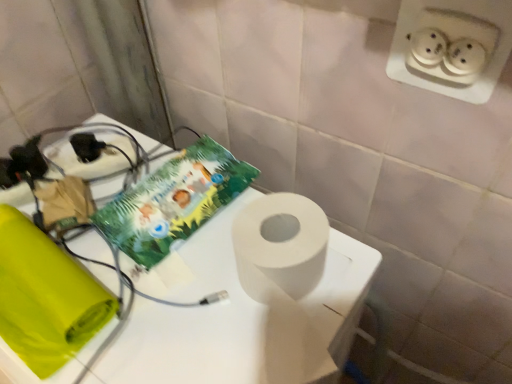
Question: Considering the relative positions of white matte table at center and green paper comic book at upper center in the image provided, is white matte table at center to the left of green paper comic book at upper center from the viewer's perspective?

Choices:
 (A) no
 (B) yes

Answer: (B)

Question: Can you confirm if white matte table at center is wider than green paper comic book at upper center?

Choices:
 (A) yes
 (B) no

Answer: (A)

Question: Is white matte table at center far away from green paper comic book at upper center?

Choices:
 (A) no
 (B) yes

Answer: (A)

Question: From a real-world perspective, does white matte table at center stand above green paper comic book at upper center?

Choices:
 (A) no
 (B) yes

Answer: (A)

Question: Is white matte table at center positioned before green paper comic book at upper center?

Choices:
 (A) yes
 (B) no

Answer: (A)

Question: Would you say green paper comic book at upper center is part of white matte table at center's contents?

Choices:
 (A) yes
 (B) no

Answer: (A)

Question: From the image's perspective, does green paper comic book at upper center appear lower than white matte table at center?

Choices:
 (A) no
 (B) yes

Answer: (A)

Question: Considering the relative positions of green paper comic book at upper center and white matte table at center in the image provided, is green paper comic book at upper center to the right of white matte table at center from the viewer's perspective?

Choices:
 (A) yes
 (B) no

Answer: (A)

Question: Is green paper comic book at upper center taller than white matte table at center?

Choices:
 (A) yes
 (B) no

Answer: (B)

Question: Is green paper comic book at upper center positioned with its back to white matte table at center?

Choices:
 (A) no
 (B) yes

Answer: (B)

Question: From a real-world perspective, is green paper comic book at upper center under white matte table at center?

Choices:
 (A) no
 (B) yes

Answer: (A)

Question: Is green paper comic book at upper center outside white matte table at center?

Choices:
 (A) yes
 (B) no

Answer: (B)

Question: Considering the positions of point (173, 190) and point (221, 324), is point (173, 190) closer or farther from the camera than point (221, 324)?

Choices:
 (A) closer
 (B) farther

Answer: (B)